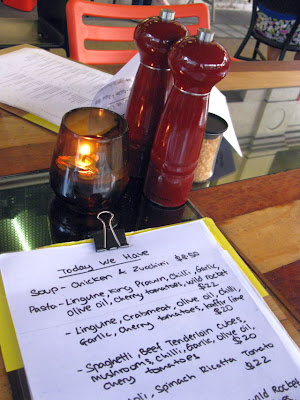
At what (x,y) coordinates should I click in order to perform the action: click on maroon salt or pepper shaker. Please return your answer as a coordinate pair (x, y). The width and height of the screenshot is (300, 400). Looking at the image, I should click on (146, 93), (178, 116).